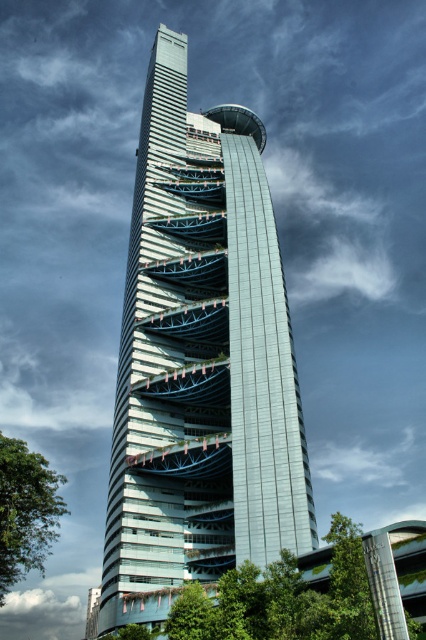
Question: Can you confirm if glassy teal skyscraper at center is positioned to the right of green leafy tree at lower left?

Choices:
 (A) yes
 (B) no

Answer: (A)

Question: Is glassy teal skyscraper at center to the left of green leafy tree at lower left from the viewer's perspective?

Choices:
 (A) yes
 (B) no

Answer: (B)

Question: Is glassy teal skyscraper at center above green leafy tree at lower left?

Choices:
 (A) no
 (B) yes

Answer: (B)

Question: Which object is closer to the camera taking this photo?

Choices:
 (A) glassy teal skyscraper at center
 (B) green leafy tree at lower left

Answer: (B)